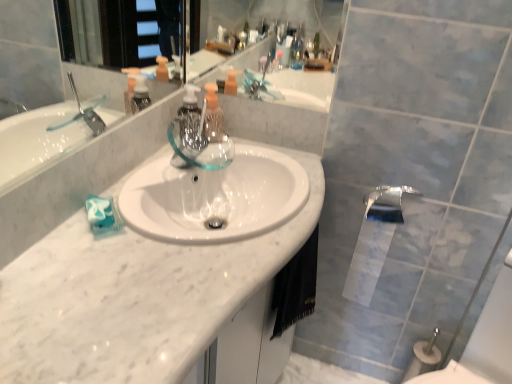
This screenshot has height=384, width=512. What do you see at coordinates (213, 114) in the screenshot?
I see `translucent plastic soap dispenser at center` at bounding box center [213, 114].

You are a GUI agent. You are given a task and a screenshot of the screen. Output one action in this format:
    pyautogui.click(x=<x>, y=<y>)
    Task: Click on the white marble counter top at center
    Image resolution: width=512 pixels, height=384 pixels.
    Given the screenshot: What is the action you would take?
    pyautogui.click(x=132, y=298)

Measure the distance between point (55, 295) and camera.

30.16 inches.

Measure the distance between white glossy toilet paper at lower right and camera.

white glossy toilet paper at lower right and camera are 4.26 feet apart.

What do you see at coordinates (368, 259) in the screenshot? This screenshot has width=512, height=384. I see `white glossy toilet paper at lower right` at bounding box center [368, 259].

Find the location of a particular element. translucent plastic soap dispenser at center is located at coordinates (213, 114).

From the image's perspective, is white marble counter top at center above translucent plastic soap dispenser at center?

Actually, white marble counter top at center appears below translucent plastic soap dispenser at center in the image.

From a real-world perspective, who is located lower, white marble counter top at center or translucent plastic soap dispenser at center?

From a 3D spatial view, white marble counter top at center is below.

Can translucent plastic soap dispenser at center be found inside white marble counter top at center?

No, translucent plastic soap dispenser at center is located outside of white marble counter top at center.

I want to click on soap dispenser on the right of white marble counter top at center, so click(x=213, y=114).

Can you tell me how much white glossy toilet paper at lower right and black fabric hand towel at lower center differ in facing direction?

The facing directions of white glossy toilet paper at lower right and black fabric hand towel at lower center are 64.1 degrees apart.

Looking at this image, considering the positions of objects white glossy toilet paper at lower right and black fabric hand towel at lower center in the image provided, who is behind, white glossy toilet paper at lower right or black fabric hand towel at lower center?

white glossy toilet paper at lower right.

Would you say black fabric hand towel at lower center is part of white glossy toilet paper at lower right's contents?

No, black fabric hand towel at lower center is not inside white glossy toilet paper at lower right.

Identify the location of hand towel above the white marble counter top at center (from the image's perspective). (296, 287).

Which object is closer to the camera taking this photo, white marble counter top at center or black fabric hand towel at lower center?

white marble counter top at center.

Is white marble counter top at center positioned beyond the bounds of black fabric hand towel at lower center?

white marble counter top at center lies outside black fabric hand towel at lower center's area.

Is white marble counter top at center not close to black fabric hand towel at lower center?

No.

Looking at this image, is white glossy toilet paper at lower right smaller than white marble counter top at center?

Yes.

From the image's perspective, does white glossy toilet paper at lower right appear lower than white marble counter top at center?

Incorrect, from the image's perspective, white glossy toilet paper at lower right is higher than white marble counter top at center.

Consider the image. Is white glossy toilet paper at lower right positioned with its back to white marble counter top at center?

No.

Which is behind, white glossy toilet paper at lower right or white marble counter top at center?

white glossy toilet paper at lower right is further away from the camera.

Considering the relative positions of black fabric hand towel at lower center and white glossy toilet paper at lower right in the image provided, is black fabric hand towel at lower center behind white glossy toilet paper at lower right?

No, black fabric hand towel at lower center is closer to the camera.

Looking at this image, is black fabric hand towel at lower center positioned far away from white glossy toilet paper at lower right?

They are positioned close to each other.

Considering the sizes of objects black fabric hand towel at lower center and white glossy toilet paper at lower right in the image provided, who is shorter, black fabric hand towel at lower center or white glossy toilet paper at lower right?

black fabric hand towel at lower center.

Does black fabric hand towel at lower center appear on the right side of white glossy toilet paper at lower right?

No.

Who is smaller, white glossy toilet paper at lower right or polished chrome tap at lower right?

With smaller size is polished chrome tap at lower right.

From the image's perspective, does white glossy toilet paper at lower right appear lower than polished chrome tap at lower right?

Indeed, from the image's perspective, white glossy toilet paper at lower right is shown beneath polished chrome tap at lower right.

In the image, is white glossy toilet paper at lower right positioned in front of or behind polished chrome tap at lower right?

In the image, white glossy toilet paper at lower right appears behind polished chrome tap at lower right.

Locate an element on the screen. The height and width of the screenshot is (384, 512). toilet paper below the polished chrome tap at lower right (from a real-world perspective) is located at coordinates (368, 259).

Between translucent plastic soap dispenser at center and white glossy toilet paper at lower right, which one has smaller size?

translucent plastic soap dispenser at center.

Is point (215, 107) positioned in front of point (378, 248)?

Yes, point (215, 107) is in front of point (378, 248).

Considering the sizes of objects translucent plastic soap dispenser at center and white glossy toilet paper at lower right in the image provided, who is wider, translucent plastic soap dispenser at center or white glossy toilet paper at lower right?

With larger width is white glossy toilet paper at lower right.

Can you see translucent plastic soap dispenser at center touching white glossy toilet paper at lower right?

No, translucent plastic soap dispenser at center is not next to white glossy toilet paper at lower right.

Image resolution: width=512 pixels, height=384 pixels. What are the coordinates of `soap dispenser on the right of white marble counter top at center` in the screenshot? It's located at pyautogui.click(x=213, y=114).

Identify the location of hand towel that is above the white glossy toilet paper at lower right (from a real-world perspective). This screenshot has width=512, height=384. (296, 287).

From the image, which object appears to be farther from black fabric hand towel at lower center, polished chrome tap at lower right or white glossy toilet paper at lower right?

polished chrome tap at lower right is further to black fabric hand towel at lower center.

Which object lies nearer to the anchor point black fabric hand towel at lower center, white glossy toilet paper at lower right or translucent plastic soap dispenser at center?

Among the two, white glossy toilet paper at lower right is located nearer to black fabric hand towel at lower center.

Based on their spatial positions, is white glossy toilet paper at lower right or polished chrome tap at lower right closer to translucent plastic soap dispenser at center?

polished chrome tap at lower right.

From the image, which object appears to be farther from white glossy toilet paper at lower right, black fabric hand towel at lower center or white marble counter top at center?

white marble counter top at center lies further to white glossy toilet paper at lower right than the other object.

Looking at the image, which one is located closer to white marble counter top at center, translucent plastic soap dispenser at center or white glossy toilet paper at lower right?

translucent plastic soap dispenser at center is positioned closer to the anchor white marble counter top at center.

Looking at the image, which one is located further to white glossy toilet paper at lower right, translucent plastic soap dispenser at center or white marble counter top at center?

white marble counter top at center is positioned further to the anchor white glossy toilet paper at lower right.

When comparing their distances from polished chrome tap at lower right, does translucent plastic soap dispenser at center or white marble counter top at center seem further?

white marble counter top at center.

Consider the image. Considering their positions, is polished chrome tap at lower right positioned closer to translucent plastic soap dispenser at center than white glossy toilet paper at lower right?

The object closer to translucent plastic soap dispenser at center is polished chrome tap at lower right.

Image resolution: width=512 pixels, height=384 pixels. Find the location of `toilet paper between translucent plastic soap dispenser at center and polished chrome tap at lower right`. toilet paper between translucent plastic soap dispenser at center and polished chrome tap at lower right is located at coordinates (368, 259).

The image size is (512, 384). I want to click on tap between white marble counter top at center and white glossy toilet paper at lower right from front to back, so click(387, 203).

Identify the location of hand towel positioned between white marble counter top at center and white glossy toilet paper at lower right from near to far. The image size is (512, 384). (296, 287).

The width and height of the screenshot is (512, 384). I want to click on hand towel between white marble counter top at center and polished chrome tap at lower right along the z-axis, so click(296, 287).